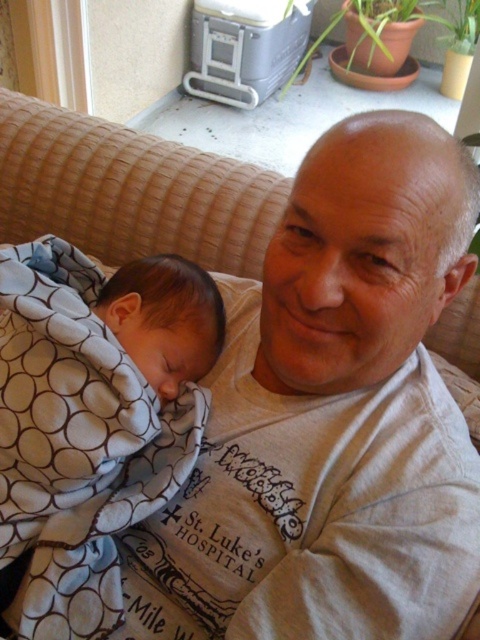
Question: Which point is closer to the camera taking this photo?

Choices:
 (A) (48, 540)
 (B) (186, 371)

Answer: (A)

Question: Among these points, which one is farthest from the camera?

Choices:
 (A) (128, 284)
 (B) (9, 477)

Answer: (A)

Question: Observing the image, what is the correct spatial positioning of white dotted fabric at left in reference to soft blue blanket at lower left?

Choices:
 (A) right
 (B) left

Answer: (B)

Question: Can you confirm if white dotted fabric at left is wider than soft blue blanket at lower left?

Choices:
 (A) yes
 (B) no

Answer: (A)

Question: Is white dotted fabric at left above soft blue blanket at lower left?

Choices:
 (A) no
 (B) yes

Answer: (A)